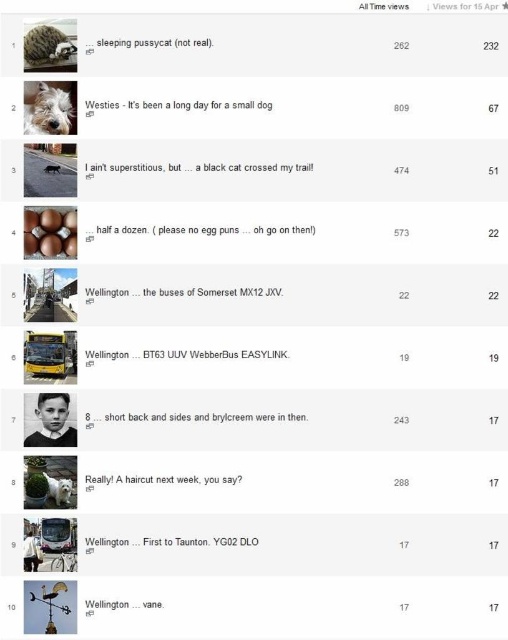
You are a content curator reviewing the video thumbnails. The platform requires that all animal videos must have the animal centered in the frame. The fluffy white dog at upper left is currently positioned at point 0.173, 0.096. Does this placement comply with the platform requirement?

The fluffy white dog at upper left is located at point (48, 109), which is not centered. Therefore, it does not comply with the platform requirement.

In the scene where both the fluffy white dog at upper left and the fluffy brown hedgehog at upper left are present, which one is closer to the viewer?

The fluffy white dog at upper left is closer to the viewer because the fluffy brown hedgehog at upper left is positioned behind it.

You are a content creator analyzing the thumbnails of two videos. You notice the fluffy white dog at upper left and the fluffy brown hedgehog at upper left. Which animal in the thumbnails is bigger?

The fluffy white dog at upper left is larger in size than the fluffy brown hedgehog at upper left.